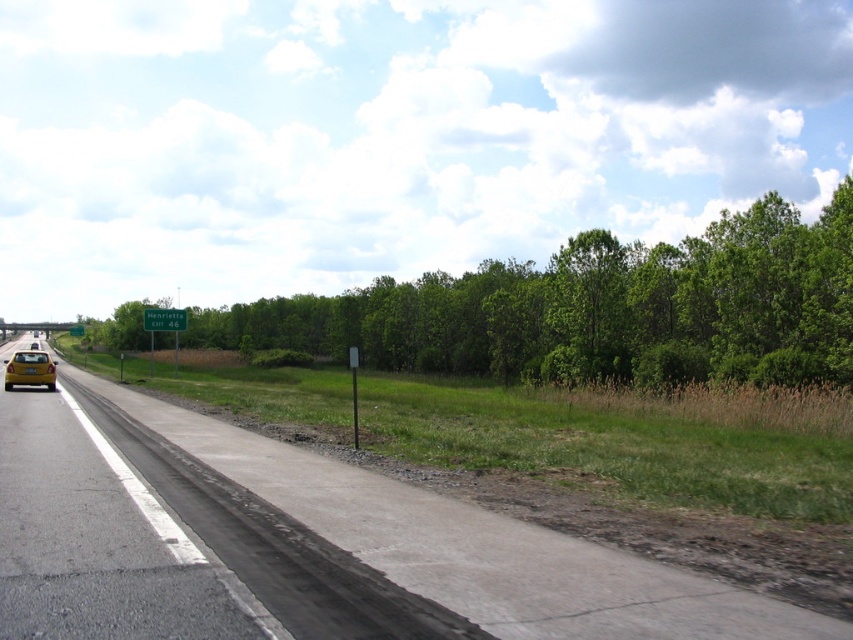
Question: Is asphalt road at center closer to camera compared to green leafy tree at upper center?

Choices:
 (A) no
 (B) yes

Answer: (B)

Question: Which object is closer to the camera taking this photo?

Choices:
 (A) yellow matte license plate at center
 (B) green leafy tree at upper center

Answer: (A)

Question: Among these points, which one is nearest to the camera?

Choices:
 (A) (410, 493)
 (B) (51, 374)
 (C) (732, 230)

Answer: (A)

Question: Is green leafy tree at upper center positioned at the back of yellow matte license plate at center?

Choices:
 (A) yes
 (B) no

Answer: (A)

Question: Is green leafy tree at upper center further to the viewer compared to yellow matte taxi at lower left?

Choices:
 (A) no
 (B) yes

Answer: (B)

Question: Considering the real-world distances, which object is farthest from the yellow matte taxi at lower left?

Choices:
 (A) green leafy tree at upper center
 (B) yellow matte license plate at center
 (C) asphalt road at center

Answer: (A)